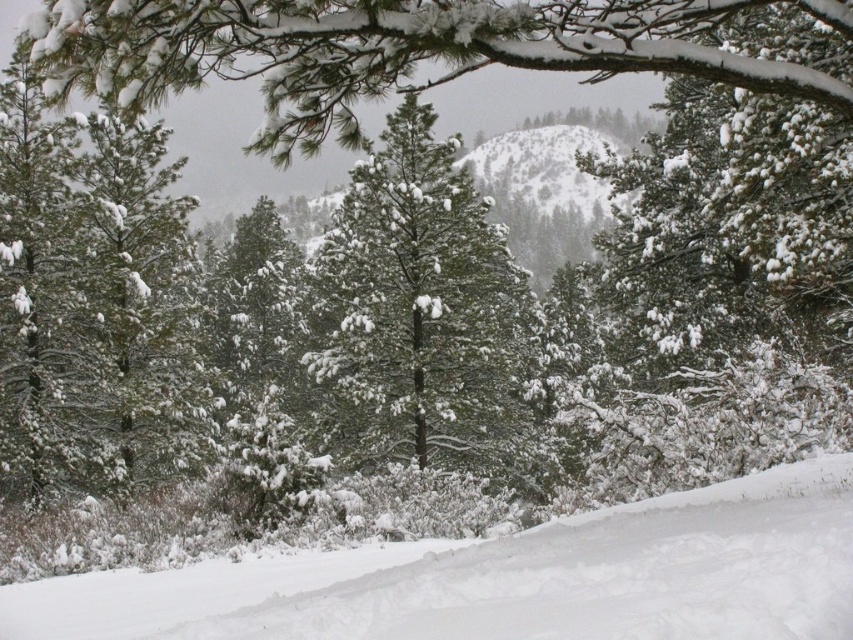
Is point (799, 616) behind point (375, 324)?

No, it is not.

Describe the element at coordinates (508, 579) in the screenshot. I see `white snow ski slope at lower center` at that location.

The width and height of the screenshot is (853, 640). Find the location of `white snow ski slope at lower center`. white snow ski slope at lower center is located at coordinates (508, 579).